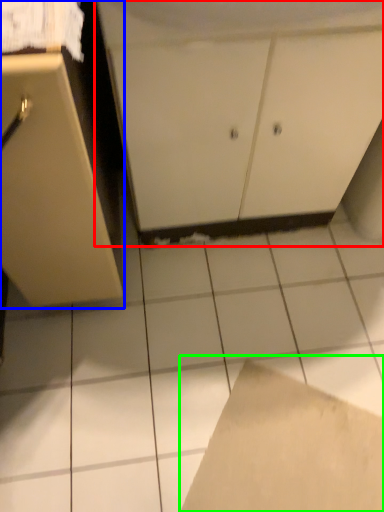
Question: Which object is positioned closest to cabinetry (highlighted by a red box)? Select from cabinetry (highlighted by a blue box) and cardboard (highlighted by a green box).

Choices:
 (A) cabinetry
 (B) cardboard

Answer: (A)